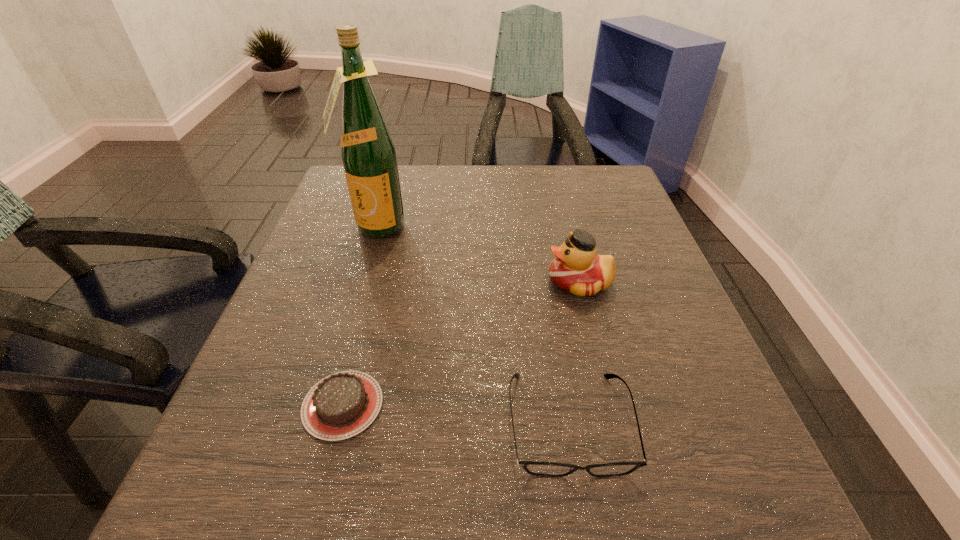
Where is `vacant space at the far edge of the desktop`? The image size is (960, 540). vacant space at the far edge of the desktop is located at coordinates (474, 189).

In the image, there is a desktop. Identify the location of free region at the near edge. (568, 479).

This screenshot has height=540, width=960. I want to click on free space at the left edge of the desktop, so click(x=351, y=308).

In the image, there is a desktop. At what (x,y) coordinates should I click in order to perform the action: click on vacant space at the right edge. Please return your answer as a coordinate pair (x, y). Looking at the image, I should click on (636, 438).

Image resolution: width=960 pixels, height=540 pixels. Find the location of `free spot at the far right corner of the desktop`. free spot at the far right corner of the desktop is located at coordinates (579, 182).

This screenshot has height=540, width=960. Find the location of `vacant space at the near right corner of the desktop`. vacant space at the near right corner of the desktop is located at coordinates (649, 503).

The image size is (960, 540). I want to click on vacant point located between the farthest object and the third tallest object, so click(472, 325).

At what (x,y) coordinates should I click in order to perform the action: click on free area in between the tallest object and the second farthest object. Please return your answer as a coordinate pair (x, y). Looking at the image, I should click on click(x=477, y=255).

Where is `vacant area that lies between the shortest object and the spectacles`? This screenshot has width=960, height=540. vacant area that lies between the shortest object and the spectacles is located at coordinates (456, 414).

Locate an element on the screen. The width and height of the screenshot is (960, 540). free spot between the chocolate cake and the third shortest object is located at coordinates (461, 343).